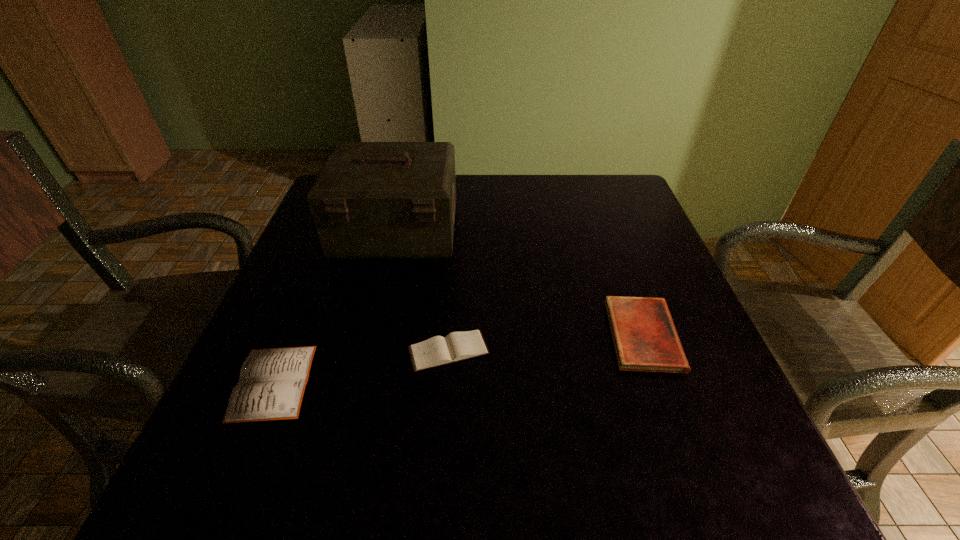
I want to click on diary that stands as the second closest to the second diary from right to left, so click(x=645, y=339).

The height and width of the screenshot is (540, 960). What are the coordinates of `free region that satisfies the following two spatial constraints: 1. on the back side of the rightmost object; 2. on the right side of the leftmost diary` in the screenshot? It's located at (293, 335).

Where is `vacant space that satisfies the following two spatial constraints: 1. on the back side of the leftmost diary; 2. on the left side of the rightmost diary`? vacant space that satisfies the following two spatial constraints: 1. on the back side of the leftmost diary; 2. on the left side of the rightmost diary is located at coordinates (293, 335).